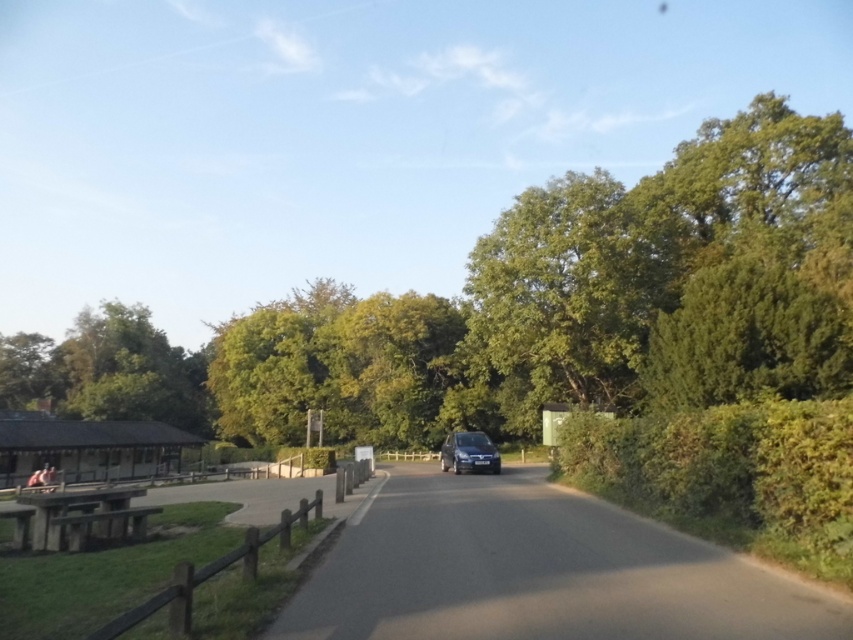
Can you confirm if concrete picnic table at lower left is shorter than satin black car at center?

In fact, concrete picnic table at lower left may be taller than satin black car at center.

Between concrete picnic table at lower left and satin black car at center, which one appears on the left side from the viewer's perspective?

Positioned to the left is concrete picnic table at lower left.

Measure the distance between concrete picnic table at lower left and camera.

concrete picnic table at lower left is 40.07 feet from camera.

This screenshot has width=853, height=640. I want to click on concrete picnic table at lower left, so click(80, 516).

Is black asphalt driveway at center wider than satin black car at center?

Indeed, black asphalt driveway at center has a greater width compared to satin black car at center.

Who is more distant from viewer, (422, 636) or (453, 468)?

The point (453, 468) is behind.

Where is `black asphalt driveway at center`? black asphalt driveway at center is located at coordinates (538, 572).

This screenshot has width=853, height=640. Find the location of `black asphalt driveway at center`. black asphalt driveway at center is located at coordinates (538, 572).

The image size is (853, 640). Describe the element at coordinates (538, 572) in the screenshot. I see `black asphalt driveway at center` at that location.

Which of these two, black asphalt driveway at center or concrete picnic table at lower left, stands taller?

Standing taller between the two is concrete picnic table at lower left.

Identify the location of black asphalt driveway at center. (538, 572).